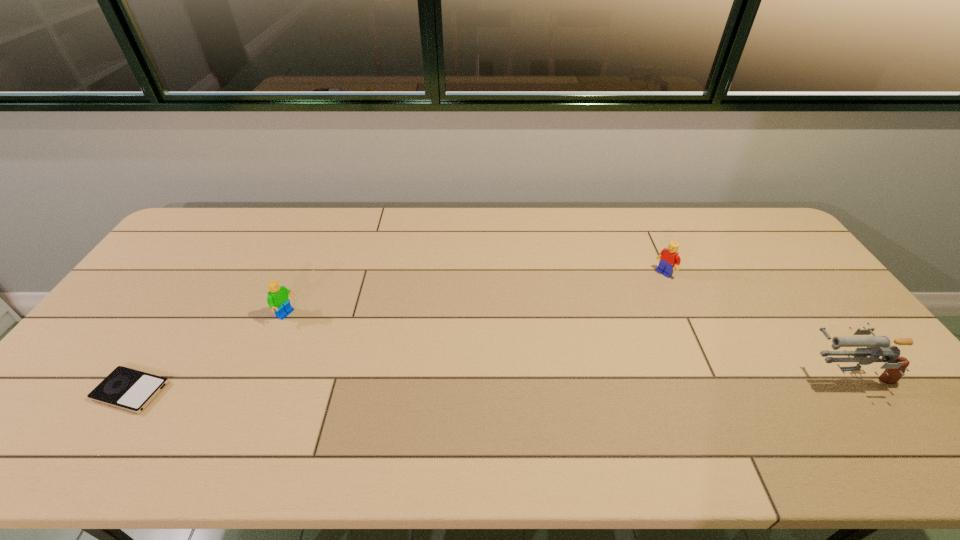
Image resolution: width=960 pixels, height=540 pixels. What are the coordinates of `object that is at the left edge` in the screenshot? It's located at (125, 388).

This screenshot has width=960, height=540. Find the location of `object that is at the right edge`. object that is at the right edge is located at coordinates (876, 346).

Where is `object present at the near left corner`? This screenshot has width=960, height=540. object present at the near left corner is located at coordinates (125, 388).

Locate an element on the screen. Image resolution: width=960 pixels, height=540 pixels. object positioned at the near right corner is located at coordinates (876, 346).

The height and width of the screenshot is (540, 960). I want to click on vacant space at the far edge of the desktop, so click(587, 224).

Where is `free location at the near edge`? The height and width of the screenshot is (540, 960). free location at the near edge is located at coordinates (253, 410).

In the image, there is a desktop. Where is `vacant space at the right edge`? vacant space at the right edge is located at coordinates (882, 383).

In order to click on blank space at the far left corner of the desktop in this screenshot , I will do `click(181, 247)`.

Locate an element on the screen. The image size is (960, 540). vacant space at the far right corner of the desktop is located at coordinates (778, 245).

Find the location of a particular element. This screenshot has width=960, height=540. free point between the farthest object and the left Lego is located at coordinates (475, 294).